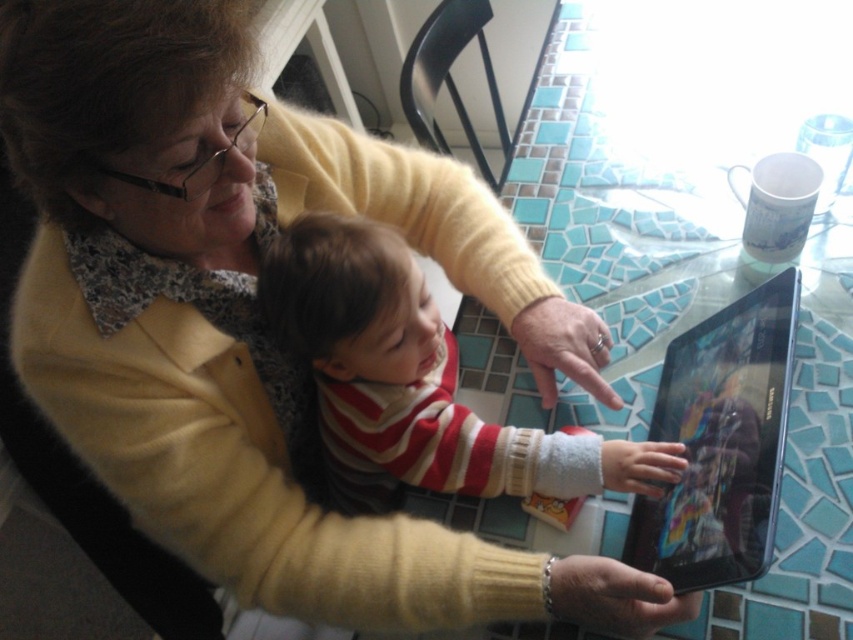
Is striped sweater at center thinner than black glossy tablet at center?

No.

Which is more to the right, striped sweater at center or black glossy tablet at center?

black glossy tablet at center

This screenshot has height=640, width=853. What do you see at coordinates (415, 381) in the screenshot?
I see `striped sweater at center` at bounding box center [415, 381].

This screenshot has height=640, width=853. What are the coordinates of `striped sweater at center` in the screenshot? It's located at (415, 381).